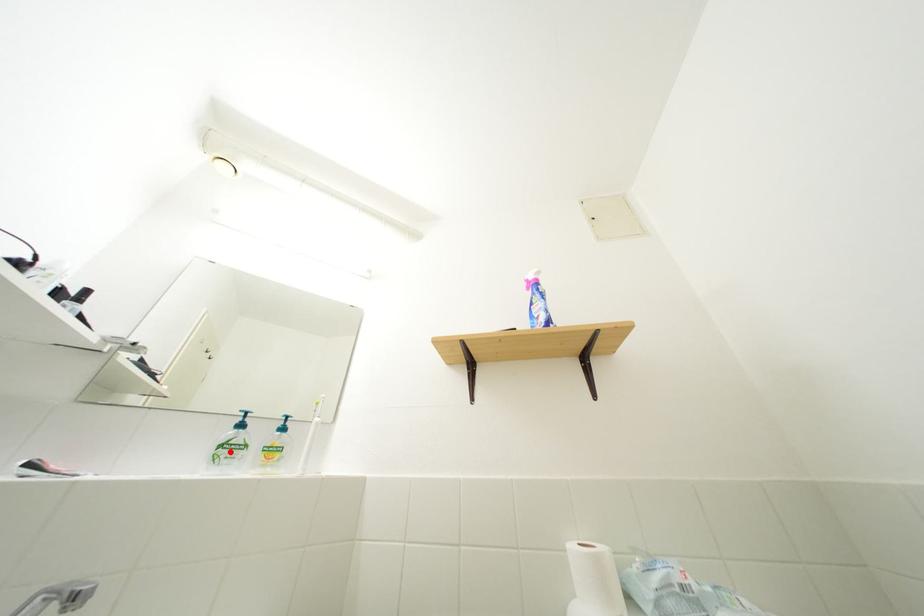
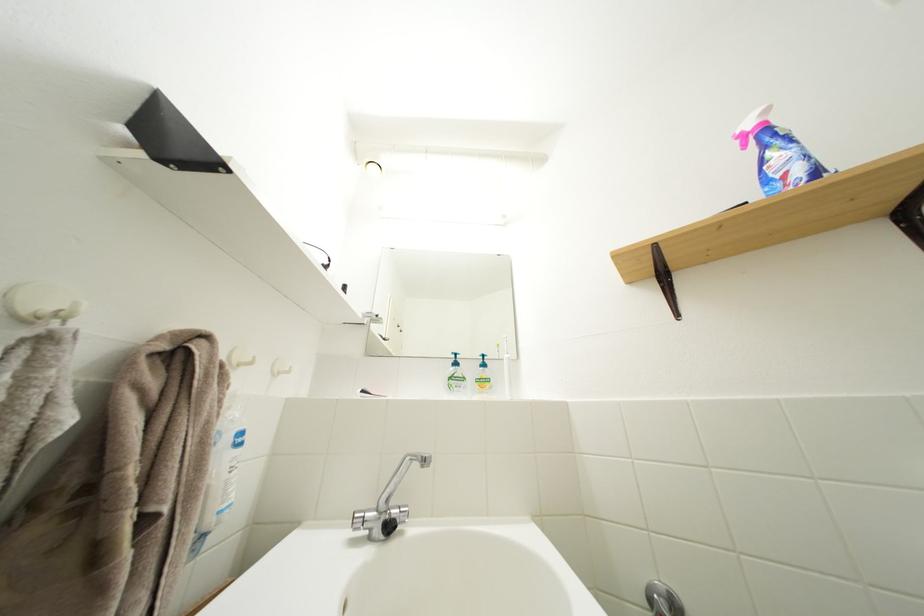
In the second image, find the point that corresponds to the highlighted location in the first image.

(458, 384)